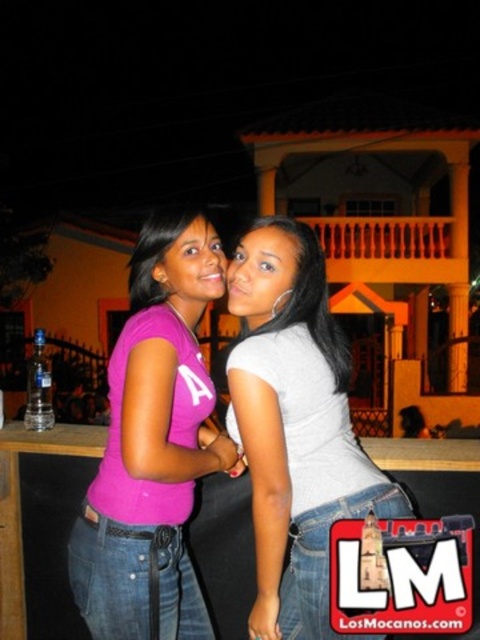
Question: Does matte pink t-shirt at center have a lesser width compared to gray matte shirt at center?

Choices:
 (A) yes
 (B) no

Answer: (A)

Question: Considering the relative positions of matte pink t-shirt at center and gray matte shirt at center in the image provided, where is matte pink t-shirt at center located with respect to gray matte shirt at center?

Choices:
 (A) left
 (B) right

Answer: (A)

Question: Among these points, which one is nearest to the camera?

Choices:
 (A) (308, 360)
 (B) (140, 380)

Answer: (B)

Question: Which of the following is the farthest from the observer?

Choices:
 (A) gray matte shirt at center
 (B) matte pink t-shirt at center

Answer: (A)

Question: Is matte pink t-shirt at center above gray matte shirt at center?

Choices:
 (A) yes
 (B) no

Answer: (B)

Question: Which point is farther from the camera taking this photo?

Choices:
 (A) (181, 349)
 (B) (321, 556)

Answer: (A)